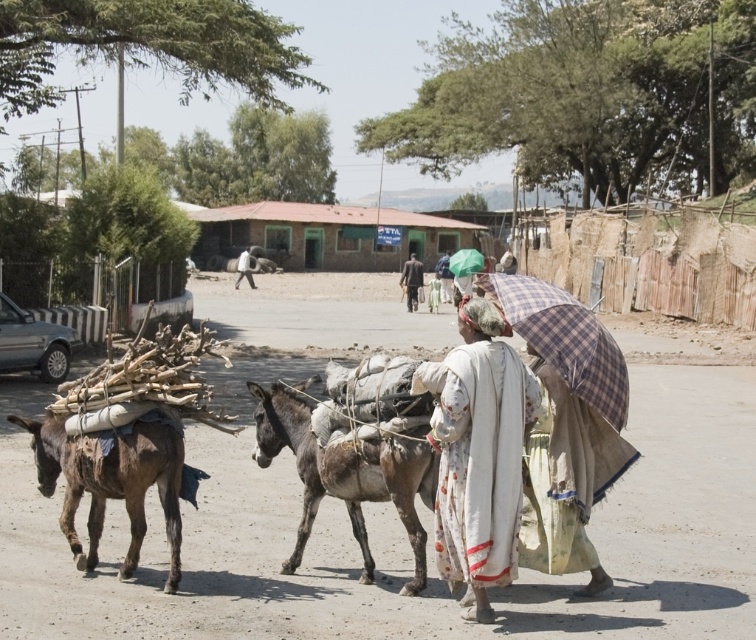
You are a traveler standing at the edge of the dirt road where the two donkeys are walking. You need to cross the road to reach a tree on the other side. The plaid fabric umbrella at center and the dark brown fabric at center are both in your path. Can you walk between them without going around?

The plaid fabric umbrella at center and dark brown fabric at center are 27.28 meters apart, so yes, you can walk between them without going around since there is enough space between them.

You are standing on the dirt road and want to walk towards the two points marked in the image. Which point will you reach first, point (394, 436) or point (596, 337)?

You will reach point (394, 436) first because it is closer to you than point (596, 337), which is further away.